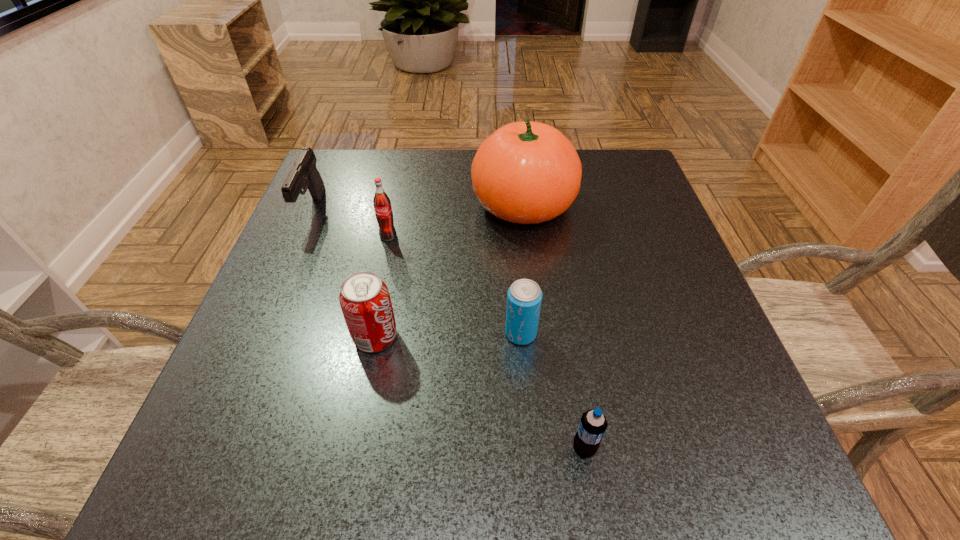
The height and width of the screenshot is (540, 960). I want to click on object identified as the third closest to the pumpkin, so click(364, 298).

I want to click on soda bottle that is the third closest to the farthest soda bottle, so click(592, 426).

Find the location of `soda bottle that is the second closest one to the farthest soda bottle`. soda bottle that is the second closest one to the farthest soda bottle is located at coordinates (524, 297).

The image size is (960, 540). What are the coordinates of `vacant space that satisfies the following two spatial constraints: 1. aim along the barrel of the pistol; 2. on the left side of the nearest object` in the screenshot? It's located at (210, 449).

The height and width of the screenshot is (540, 960). I want to click on free space that satisfies the following two spatial constraints: 1. aim along the barrel of the leftmost object; 2. on the right side of the third soda bottle from left to right, so click(259, 334).

I want to click on free space that satisfies the following two spatial constraints: 1. on the label of the farthest soda bottle; 2. on the right side of the nearest soda bottle, so click(x=342, y=449).

This screenshot has height=540, width=960. Identify the location of vacant area that satisfies the following two spatial constraints: 1. aim along the barrel of the pistol; 2. on the right side of the third soda bottle from left to right. (259, 334).